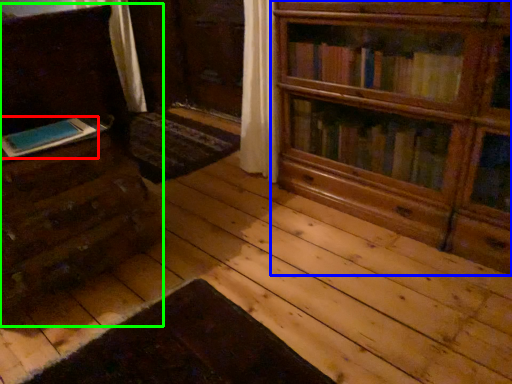
Question: Based on their relative distances, which object is nearer to book (highlighted by a red box)? Choose from bookcase (highlighted by a blue box) and chest of drawers (highlighted by a green box).

Choices:
 (A) bookcase
 (B) chest of drawers

Answer: (B)